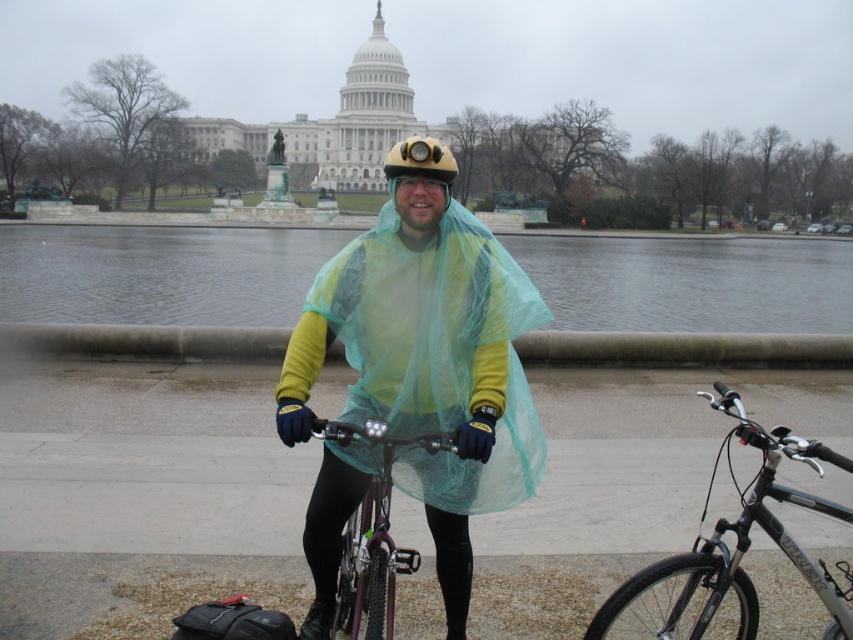
Question: Estimate the real-world distances between objects in this image. Which object is farther from the shiny purple bicycle at center?

Choices:
 (A) yellow matte helmet at center
 (B) translucent green poncho at center
 (C) silver metallic bicycle at center

Answer: (A)

Question: Which point appears closest to the camera in this image?

Choices:
 (A) (780, 448)
 (B) (357, 428)
 (C) (412, 166)
 (D) (392, 426)

Answer: (A)

Question: Among these points, which one is farthest from the camera?

Choices:
 (A) (444, 156)
 (B) (509, 269)
 (C) (363, 544)

Answer: (B)

Question: Is translucent green poncho at center above yellow matte helmet at center?

Choices:
 (A) no
 (B) yes

Answer: (A)

Question: Is silver metallic bicycle at center bigger than yellow matte helmet at center?

Choices:
 (A) yes
 (B) no

Answer: (B)

Question: Is silver metallic bicycle at center above yellow matte helmet at center?

Choices:
 (A) yes
 (B) no

Answer: (B)